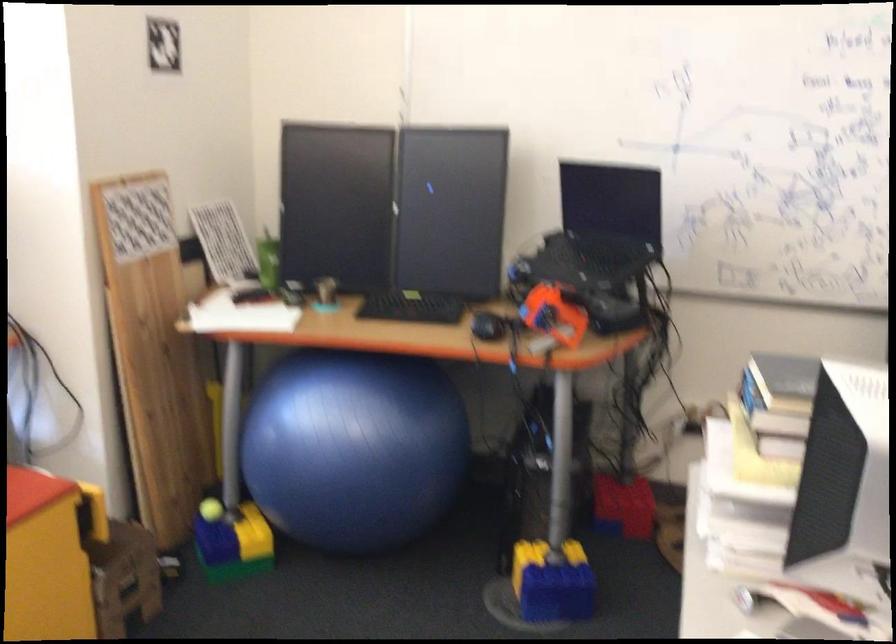
Which object does [601,225] point to?

This point indicates the black laptop.